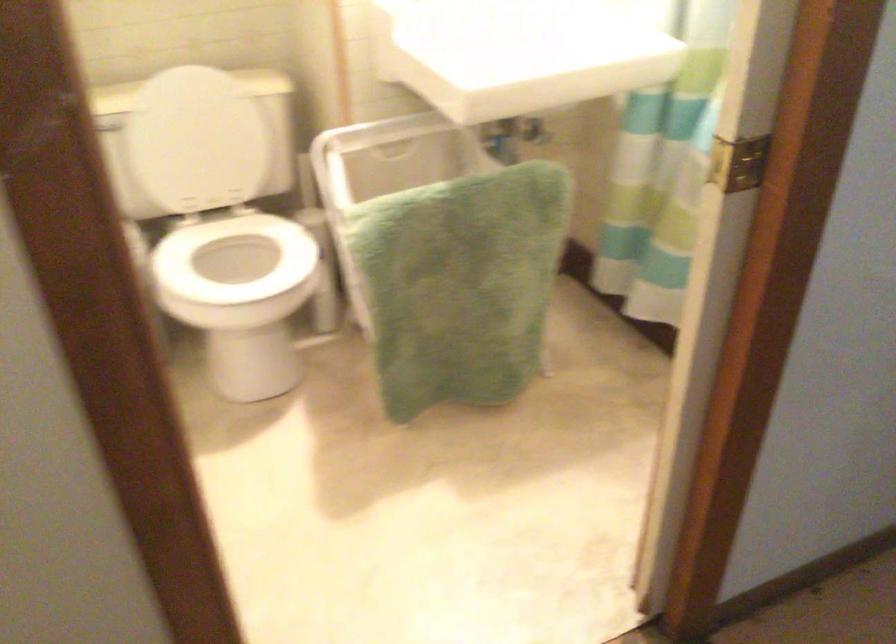
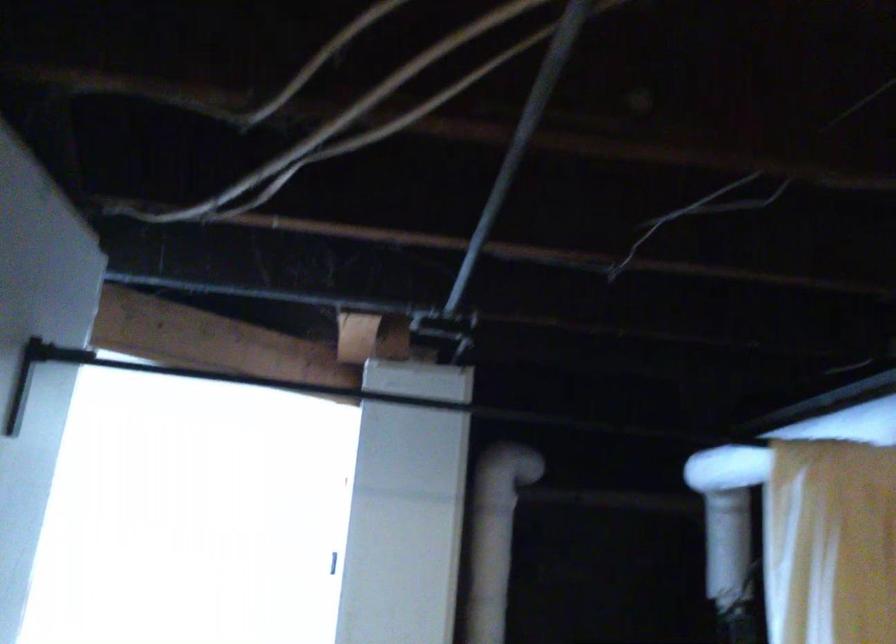
Based on the continuous images, in which direction is the camera rotating?

The camera's rotation is toward right-up.